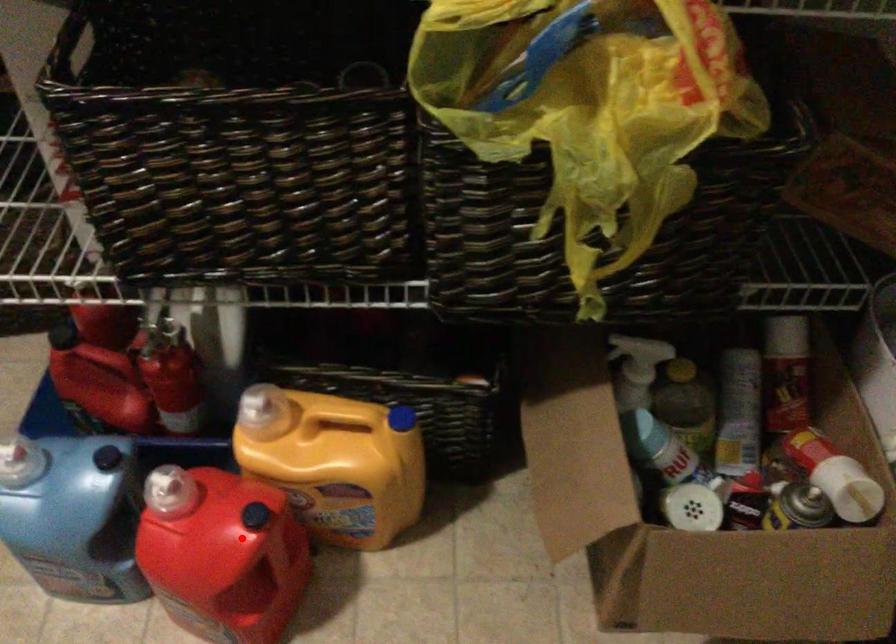
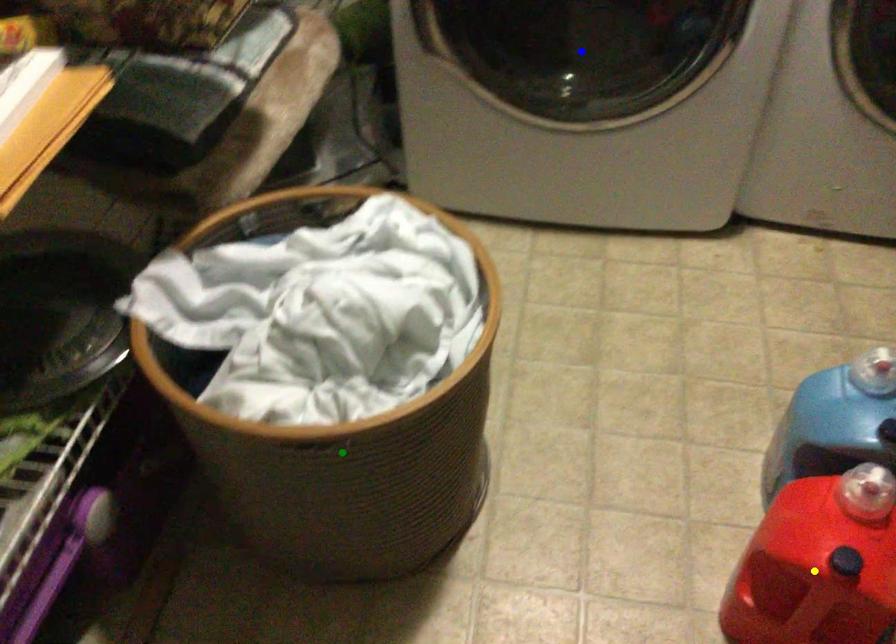
Question: I am providing you with two images of the same scene from different viewpoints. A red point is marked on the first image. You are given multiple points on the second image. Which mark in image 2 goes with the point in image 1?

Choices:
 (A) green point
 (B) yellow point
 (C) blue point

Answer: (B)